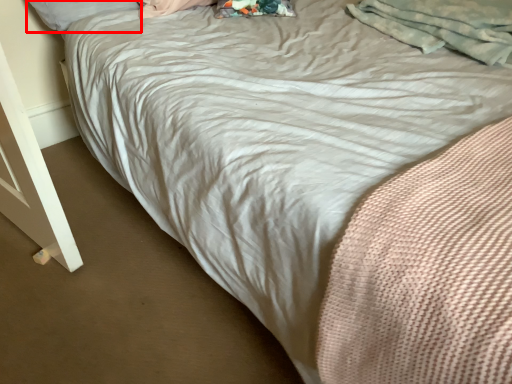
Question: From the image's perspective, where is pillow (annotated by the red box) located relative to material?

Choices:
 (A) above
 (B) below

Answer: (A)